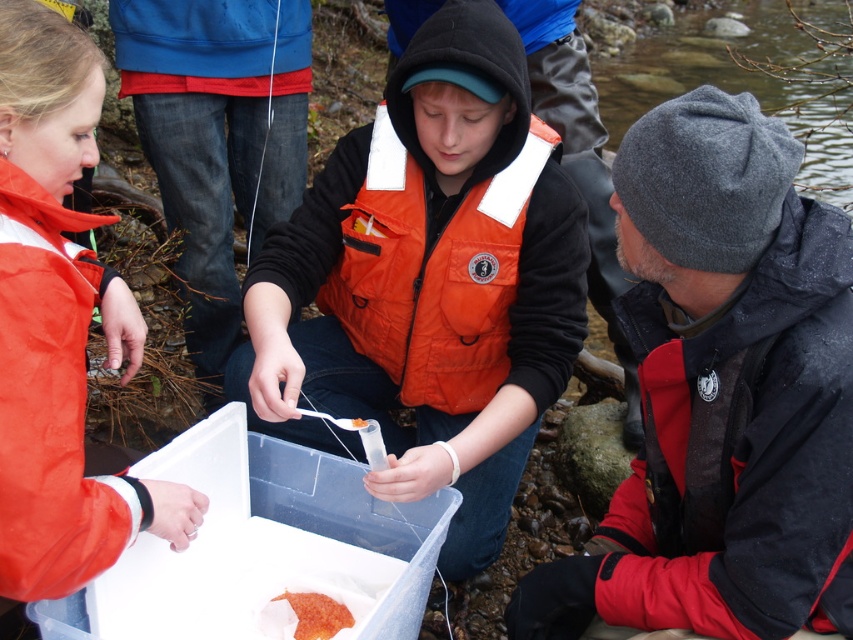
Question: Is orange matte food at center above orange gelatinous substance at center?

Choices:
 (A) no
 (B) yes

Answer: (A)

Question: Based on their relative distances, which object is nearer to the orange fabric vest at center?

Choices:
 (A) orange quilted life jacket at center
 (B) orange gelatinous substance at center

Answer: (A)

Question: Among these points, which one is nearest to the camera?

Choices:
 (A) (683, 362)
 (B) (480, 560)

Answer: (A)

Question: Observing the image, what is the correct spatial positioning of orange life vest at center in reference to orange matte food at center?

Choices:
 (A) left
 (B) right

Answer: (B)

Question: Which point is farther to the camera?

Choices:
 (A) orange matte food at center
 (B) orange fabric vest at center
 (C) orange gelatinous substance at center

Answer: (A)

Question: Is orange quilted life jacket at center to the right of orange gelatinous substance at center from the viewer's perspective?

Choices:
 (A) yes
 (B) no

Answer: (A)